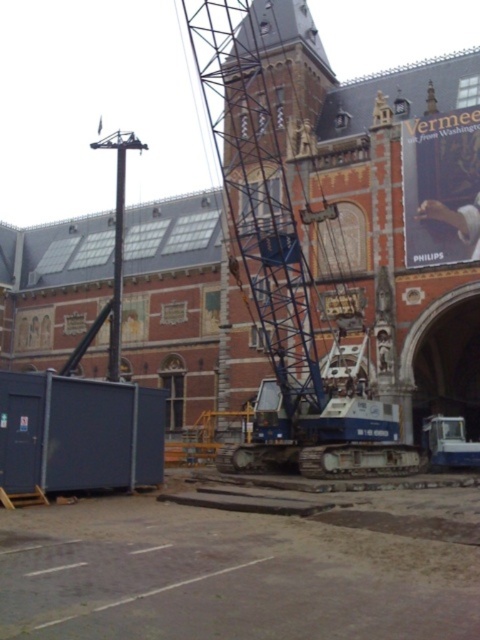
You are a construction worker who needs to move a large steel beam that is 10 meters long. You see the blue metallic crane at center and the metallic blue crane at center. Which crane has a wider base to safely support the load?

The blue metallic crane at center has a wider base than the metallic blue crane at center, so it is safer to use the blue metallic crane at center for the large steel beam.

You are standing at the point marked as point (34, 403) on the construction site. The nearest entrance to the building is 37.87 meters away. If you need to reach the entrance quickly, which direction should you move towards?

You should move towards the entrance, which is 37.87 meters away from the point (34, 403). The direction depends on the layout of the construction site, but the shortest path would be a straight line towards the entrance.

You are a delivery driver who just arrived at the construction site. You need to unload the metallic blue container at lower left using the blue metallic crane at center. Can you safely position the crane to the right of the container?

The blue metallic crane at center is already positioned on the right side of metallic blue container at lower left, so you can safely proceed with unloading.